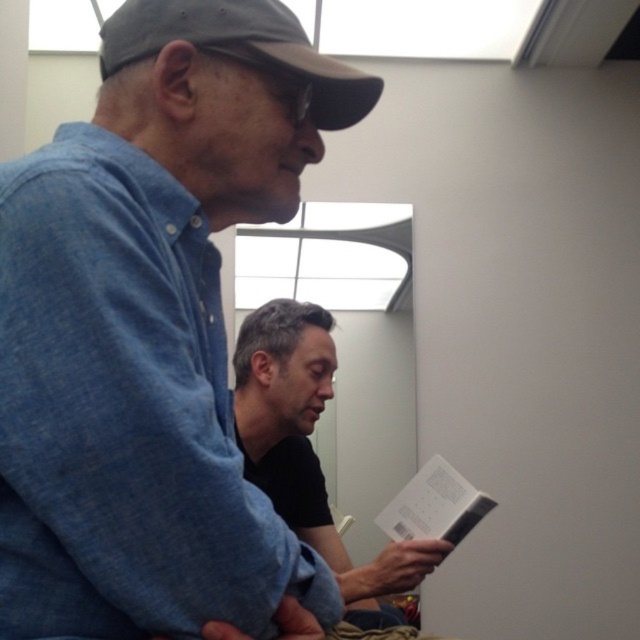
Question: Which point appears farthest from the camera in this image?

Choices:
 (A) coord(422,516)
 (B) coord(312,486)
 (C) coord(339,72)
 (D) coord(152,285)

Answer: (B)

Question: Is denim shirt at left positioned in front of white paper at lower center?

Choices:
 (A) yes
 (B) no

Answer: (A)

Question: Among these objects, which one is farthest from the camera?

Choices:
 (A) black matte baseball cap at upper left
 (B) white paper at lower center

Answer: (B)

Question: In this image, where is black matte baseball cap at upper left located relative to white paper at lower center?

Choices:
 (A) below
 (B) above

Answer: (B)

Question: Which point is closer to the camera?

Choices:
 (A) click(144, 321)
 (B) click(342, 92)
 (C) click(461, 481)

Answer: (A)

Question: Does black matte baseball cap at upper left appear on the right side of white paper at lower center?

Choices:
 (A) no
 (B) yes

Answer: (A)